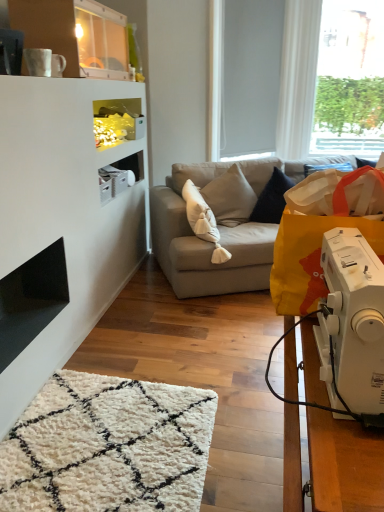
Where is `white matte window screen at upper right`? The width and height of the screenshot is (384, 512). white matte window screen at upper right is located at coordinates (250, 75).

At what (x,y) coordinates should I click in order to perform the action: click on yellow paper grocery bag at right. Please return your answer as a coordinate pair (x, y). Looking at the image, I should click on (322, 231).

Locate an element on the screen. This screenshot has height=512, width=384. light gray fabric couch at center is located at coordinates (216, 231).

What do you see at coordinates (31, 300) in the screenshot? I see `black glossy fireplace at lower left` at bounding box center [31, 300].

What do you see at coordinates (117, 122) in the screenshot?
I see `translucent glass shelf at upper center` at bounding box center [117, 122].

Measure the distance between point (125, 116) and camera.

They are 10.42 feet apart.

Where is `white matte window screen at upper right`? white matte window screen at upper right is located at coordinates (250, 75).

In terms of size, does light gray fabric couch at center appear bigger or smaller than white matte window screen at upper right?

Clearly, light gray fabric couch at center is larger in size than white matte window screen at upper right.

How different are the orientations of light gray fabric couch at center and white matte window screen at upper right in degrees?

23.3 degrees.

Considering the sizes of objects light gray fabric couch at center and white matte window screen at upper right in the image provided, who is wider, light gray fabric couch at center or white matte window screen at upper right?

light gray fabric couch at center is wider.

Where is `studio couch lying in front of the white matte window screen at upper right`? studio couch lying in front of the white matte window screen at upper right is located at coordinates (216, 231).

Could you tell me if beige fabric pillow at center is facing translucent glass shelf at upper center?

No, beige fabric pillow at center is not aimed at translucent glass shelf at upper center.

In terms of height, does beige fabric pillow at center look taller or shorter compared to translucent glass shelf at upper center?

Clearly, beige fabric pillow at center is taller compared to translucent glass shelf at upper center.

From the image's perspective, which object appears higher, beige fabric pillow at center or translucent glass shelf at upper center?

translucent glass shelf at upper center appears higher in the image.

Which object is positioned more to the left, beige fabric pillow at center or translucent glass shelf at upper center?

Positioned to the left is translucent glass shelf at upper center.

Find the location of a particular element. fireplace that is below the transparent glass window at upper right (from the image's perspective) is located at coordinates (31, 300).

Between transparent glass window at upper right and black glossy fireplace at lower left, which one has smaller width?

transparent glass window at upper right.

Is transparent glass window at upper right with black glossy fireplace at lower left?

No.

From a real-world perspective, is transparent glass window at upper right on black glossy fireplace at lower left?

Yes, from a real-world perspective, transparent glass window at upper right is above black glossy fireplace at lower left.

In the scene shown: How much distance is there between white plastic sewing machine at lower right and light gray fabric couch at center?

The distance of white plastic sewing machine at lower right from light gray fabric couch at center is 6.28 feet.

Is white plastic sewing machine at lower right touching light gray fabric couch at center?

No, white plastic sewing machine at lower right is not in contact with light gray fabric couch at center.

Looking at this image, from a real-world perspective, who is located higher, white plastic sewing machine at lower right or light gray fabric couch at center?

white plastic sewing machine at lower right is physically above.

Looking at the image, does white plastic sewing machine at lower right seem bigger or smaller compared to light gray fabric couch at center?

Considering their sizes, white plastic sewing machine at lower right takes up less space than light gray fabric couch at center.

Is black glossy fireplace at lower left shorter than white matte window screen at upper right?

Correct, black glossy fireplace at lower left is not as tall as white matte window screen at upper right.

From the picture: Does black glossy fireplace at lower left turn towards white matte window screen at upper right?

No, black glossy fireplace at lower left is not aimed at white matte window screen at upper right.

Find the location of a particular element. fireplace on the left of white matte window screen at upper right is located at coordinates (31, 300).

Are black glossy fireplace at lower left and white matte window screen at upper right located far from each other?

black glossy fireplace at lower left is positioned a significant distance from white matte window screen at upper right.

From the picture: Would you say beige fabric pillow at center is outside black glossy fireplace at lower left?

beige fabric pillow at center is positioned outside black glossy fireplace at lower left.

From the image's perspective, between beige fabric pillow at center and black glossy fireplace at lower left, who is located below?

black glossy fireplace at lower left appears lower in the image.

Considering the sizes of objects beige fabric pillow at center and black glossy fireplace at lower left in the image provided, who is wider, beige fabric pillow at center or black glossy fireplace at lower left?

beige fabric pillow at center is wider.

Is beige fabric pillow at center surrounded by light gray fabric couch at center?

Indeed, beige fabric pillow at center is located within light gray fabric couch at center.

Which point is more distant from viewer, (215, 184) or (195, 226)?

Positioned behind is point (215, 184).

Based on the photo, between light gray fabric couch at center and beige fabric pillow at center, which one has more height?

light gray fabric couch at center is taller.

In the scene shown: Based on their positions, is light gray fabric couch at center located to the left or right of beige fabric pillow at center?

light gray fabric couch at center is to the right of beige fabric pillow at center.

Locate an element on the screen. This screenshot has width=384, height=512. studio couch in front of the white matte window screen at upper right is located at coordinates (216, 231).

Identify the location of shelf that appears behind the beige fabric pillow at center. (117, 122).

Looking at the image, which one is located closer to beige fabric pillow at center, translucent glass shelf at upper center or transparent glass window at upper right?

translucent glass shelf at upper center lies closer to beige fabric pillow at center than the other object.

Which object lies nearer to the anchor point white matte window screen at upper right, transparent glass window at upper right or beige fabric pillow at center?

beige fabric pillow at center is positioned closer to the anchor white matte window screen at upper right.

Looking at the image, which one is located closer to white plastic sewing machine at lower right, translucent glass shelf at upper center or beige fabric pillow at center?

Based on the image, beige fabric pillow at center appears to be nearer to white plastic sewing machine at lower right.

Based on their spatial positions, is white matte window screen at upper right or beige fabric pillow at center further from light gray fabric couch at center?

white matte window screen at upper right is positioned further to the anchor light gray fabric couch at center.

Looking at the image, which one is located further to beige fabric pillow at center, light gray fabric couch at center or white plastic sewing machine at lower right?

Based on the image, white plastic sewing machine at lower right appears to be further to beige fabric pillow at center.

Estimate the real-world distances between objects in this image. Which object is closer to black glossy fireplace at lower left, white matte window screen at upper right or white plastic sewing machine at lower right?

Based on the image, white plastic sewing machine at lower right appears to be nearer to black glossy fireplace at lower left.

In the scene shown: When comparing their distances from black glossy fireplace at lower left, does light gray fabric couch at center or beige fabric pillow at center seem closer?

light gray fabric couch at center.

In the scene shown: Considering their positions, is yellow paper grocery bag at right positioned further to white matte window screen at upper right than light gray fabric couch at center?

Based on the image, yellow paper grocery bag at right appears to be further to white matte window screen at upper right.

Where is `studio couch located between yellow paper grocery bag at right and translucent glass shelf at upper center in the depth direction`? The width and height of the screenshot is (384, 512). studio couch located between yellow paper grocery bag at right and translucent glass shelf at upper center in the depth direction is located at coordinates pyautogui.click(x=216, y=231).

The width and height of the screenshot is (384, 512). I want to click on pillow located between white plastic sewing machine at lower right and light gray fabric couch at center in the depth direction, so click(203, 221).

Locate an element on the screen. studio couch located between white plastic sewing machine at lower right and translucent glass shelf at upper center in the depth direction is located at coordinates (216, 231).

Image resolution: width=384 pixels, height=512 pixels. What are the coordinates of `shelf between yellow paper grocery bag at right and transparent glass window at upper right along the z-axis` in the screenshot? It's located at (117, 122).